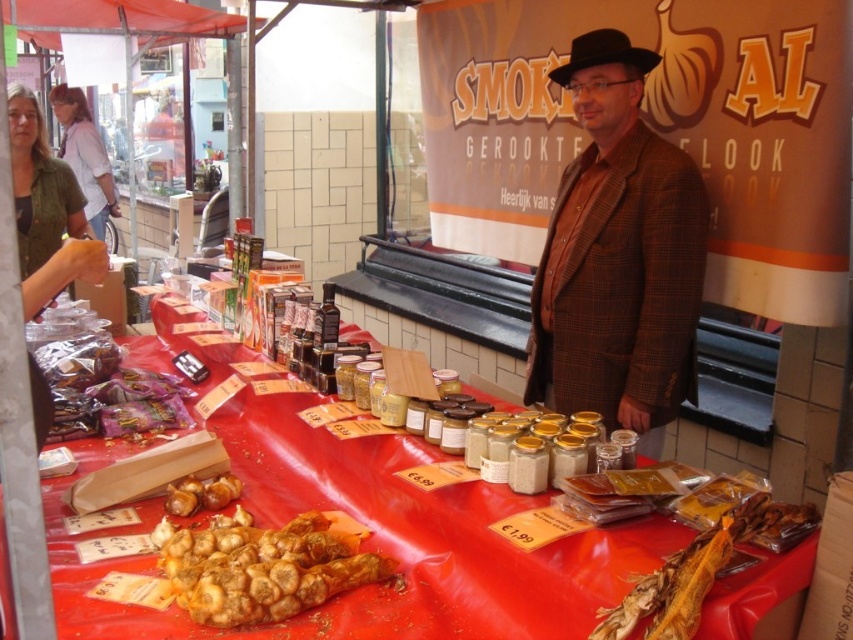
You are a customer at the market stall and want to buy both the brown crispy snack at center and the brown matte garlic at center. Which item is closer to you as you stand in front of the stall?

The brown crispy snack at center is closer to you because it is in front of the brown matte garlic at center.